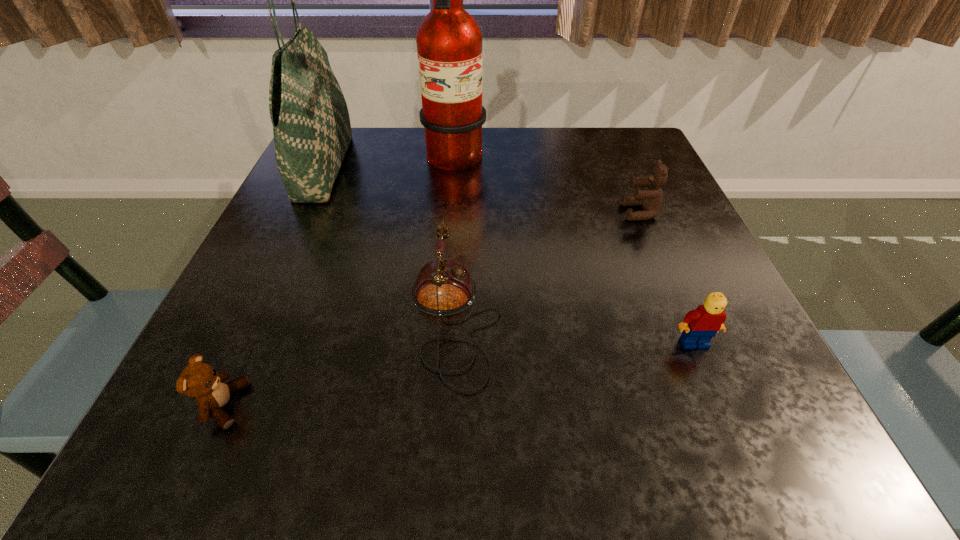
Locate an element on the screen. free location located 0.100m on the face of the taller teddy bear is located at coordinates (574, 212).

I want to click on vacant space situated on the face of the taller teddy bear, so click(442, 212).

I want to click on vacant space located on the face of the taller teddy bear, so click(x=525, y=212).

Locate an element on the screen. Image resolution: width=960 pixels, height=540 pixels. free region located 0.120m on the front-facing side of the Lego is located at coordinates (729, 426).

Where is `vacant space located on the rotary dial of the telephone`? vacant space located on the rotary dial of the telephone is located at coordinates (690, 320).

Locate an element on the screen. free space located on the front-facing side of the shortest object is located at coordinates (430, 405).

Locate an element on the screen. The image size is (960, 540). fire extinguisher situated at the far edge is located at coordinates (449, 41).

The width and height of the screenshot is (960, 540). What are the coordinates of `tote bag positioned at the far edge` in the screenshot? It's located at (311, 125).

This screenshot has width=960, height=540. What are the coordinates of `object present at the near edge` in the screenshot? It's located at (199, 380).

You are a GUI agent. You are given a task and a screenshot of the screen. Output one action in this format:
    pyautogui.click(x=<x>, y=<y>)
    Task: Click on the tote bag positioned at the left edge
    Image resolution: width=960 pixels, height=540 pixels.
    Given the screenshot: What is the action you would take?
    pyautogui.click(x=311, y=125)